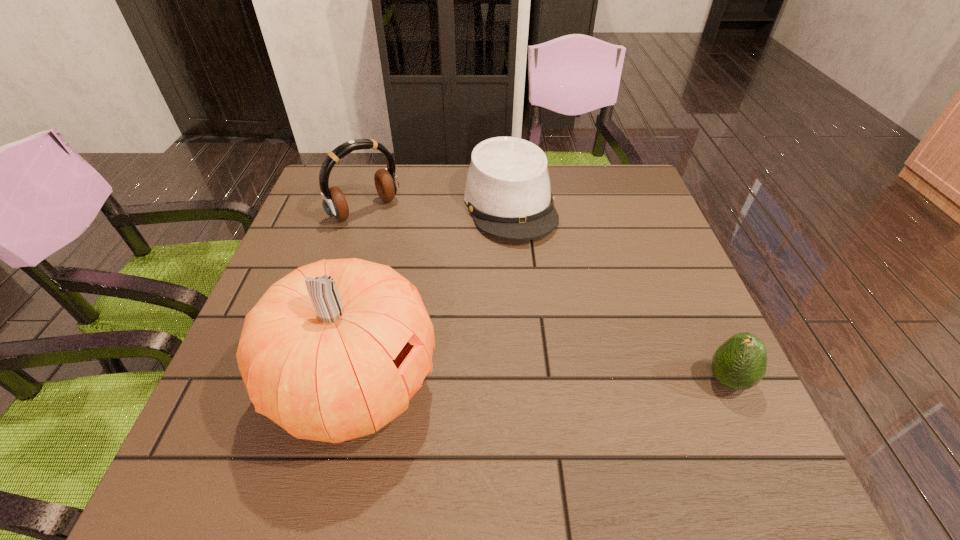
Find the location of a particular element. free space between the avocado and the tallest object is located at coordinates (541, 383).

Find the location of a particular element. Image resolution: width=960 pixels, height=540 pixels. empty space that is in between the pumpkin and the avocado is located at coordinates (541, 383).

Locate an element on the screen. This screenshot has width=960, height=540. unoccupied position between the avocado and the second object from right to left is located at coordinates (618, 292).

Find the location of `vacant space that's between the rightmost object and the tallest object`. vacant space that's between the rightmost object and the tallest object is located at coordinates (541, 383).

At what (x,y) coordinates should I click in order to perform the action: click on free area in between the headset and the hat. Please return your answer as a coordinate pair (x, y). The width and height of the screenshot is (960, 540). Looking at the image, I should click on (438, 207).

Identify the location of free space between the avocado and the second tallest object. The height and width of the screenshot is (540, 960). (546, 295).

You are a GUI agent. You are given a task and a screenshot of the screen. Output one action in this format:
    pyautogui.click(x=<x>, y=<y>)
    Task: Click on the unoccupied area between the avocado and the headset
    The height and width of the screenshot is (540, 960).
    Given the screenshot: What is the action you would take?
    pyautogui.click(x=546, y=295)

Select which object appears as the third closest to the tallest object. Please provide its 2D coordinates. Your answer should be formatted as a tuple, i.e. [(x, y)], where the tuple contains the x and y coordinates of a point satisfying the conditions above.

[(740, 363)]

Where is `the second closest object to the tallest object`? The image size is (960, 540). the second closest object to the tallest object is located at coordinates (334, 202).

This screenshot has width=960, height=540. I want to click on vacant area that satisfies the following two spatial constraints: 1. on the front side of the tallest object; 2. on the front-facing side of the second tallest object, so click(x=312, y=385).